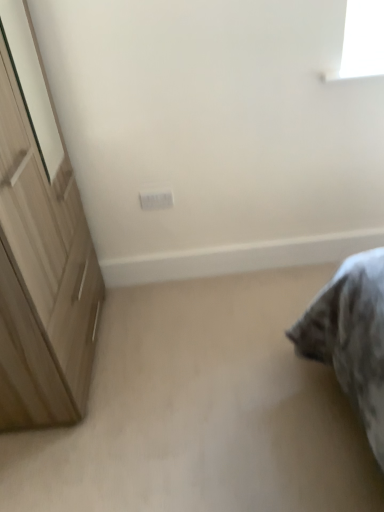
Question: Does beige carpet at lower right have a larger size compared to white plastic electric outlet at center?

Choices:
 (A) yes
 (B) no

Answer: (A)

Question: Are beige carpet at lower right and white plastic electric outlet at center located far from each other?

Choices:
 (A) yes
 (B) no

Answer: (B)

Question: Is beige carpet at lower right wider than white plastic electric outlet at center?

Choices:
 (A) yes
 (B) no

Answer: (A)

Question: Is beige carpet at lower right next to white plastic electric outlet at center and touching it?

Choices:
 (A) no
 (B) yes

Answer: (A)

Question: Does beige carpet at lower right appear on the right side of white plastic electric outlet at center?

Choices:
 (A) yes
 (B) no

Answer: (A)

Question: Is beige carpet at lower right closer to the viewer compared to white plastic electric outlet at center?

Choices:
 (A) no
 (B) yes

Answer: (B)

Question: Is white plastic electric outlet at center taller than light brown wooden cupboard at left?

Choices:
 (A) no
 (B) yes

Answer: (A)

Question: Considering the relative sizes of white plastic electric outlet at center and light brown wooden cupboard at left in the image provided, is white plastic electric outlet at center bigger than light brown wooden cupboard at left?

Choices:
 (A) yes
 (B) no

Answer: (B)

Question: Is white plastic electric outlet at center to the right of light brown wooden cupboard at left from the viewer's perspective?

Choices:
 (A) yes
 (B) no

Answer: (A)

Question: Is white plastic electric outlet at center not inside light brown wooden cupboard at left?

Choices:
 (A) yes
 (B) no

Answer: (A)

Question: Is white plastic electric outlet at center aimed at light brown wooden cupboard at left?

Choices:
 (A) no
 (B) yes

Answer: (A)

Question: Is light brown wooden cupboard at left surrounded by white plastic electric outlet at center?

Choices:
 (A) no
 (B) yes

Answer: (A)

Question: From the image's perspective, is light brown wooden cupboard at left on white plastic electric outlet at center?

Choices:
 (A) no
 (B) yes

Answer: (A)